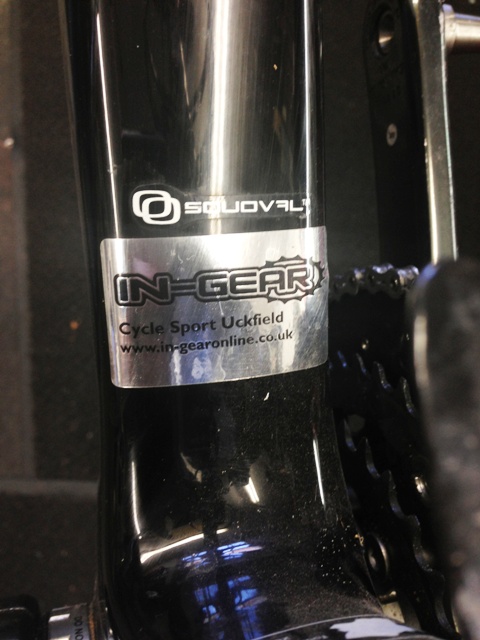
Locate an element on the screen. Image resolution: width=480 pixels, height=640 pixels. sticker is located at coordinates (180, 246), (179, 202).